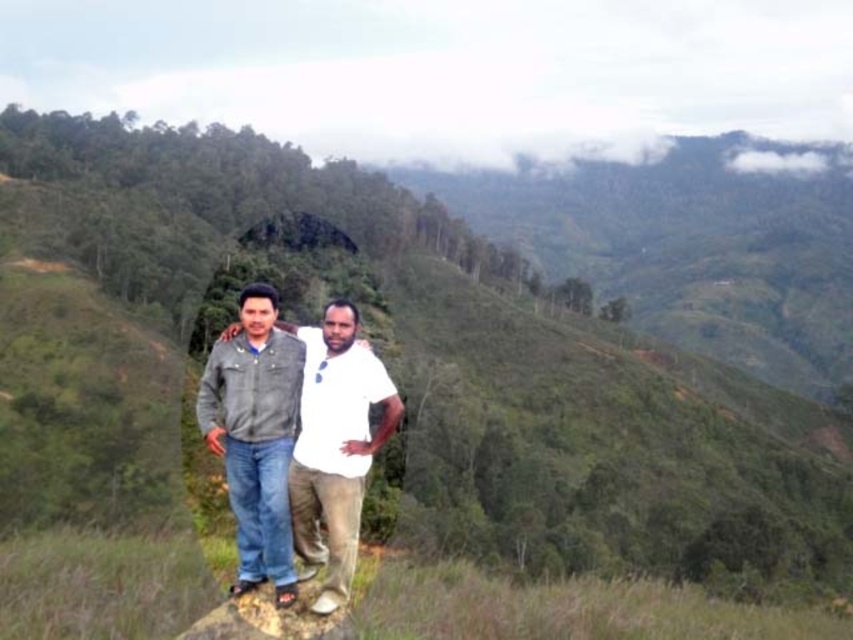
Question: Which of the following is the farthest from the observer?

Choices:
 (A) smooth gray rock at lower center
 (B) denim jacket at center

Answer: (B)

Question: Is denim jacket at center in front of smooth gray rock at lower center?

Choices:
 (A) yes
 (B) no

Answer: (B)

Question: Can you confirm if denim jacket at center is thinner than smooth gray rock at lower center?

Choices:
 (A) yes
 (B) no

Answer: (B)

Question: Is denim jacket at center below smooth gray rock at lower center?

Choices:
 (A) yes
 (B) no

Answer: (B)